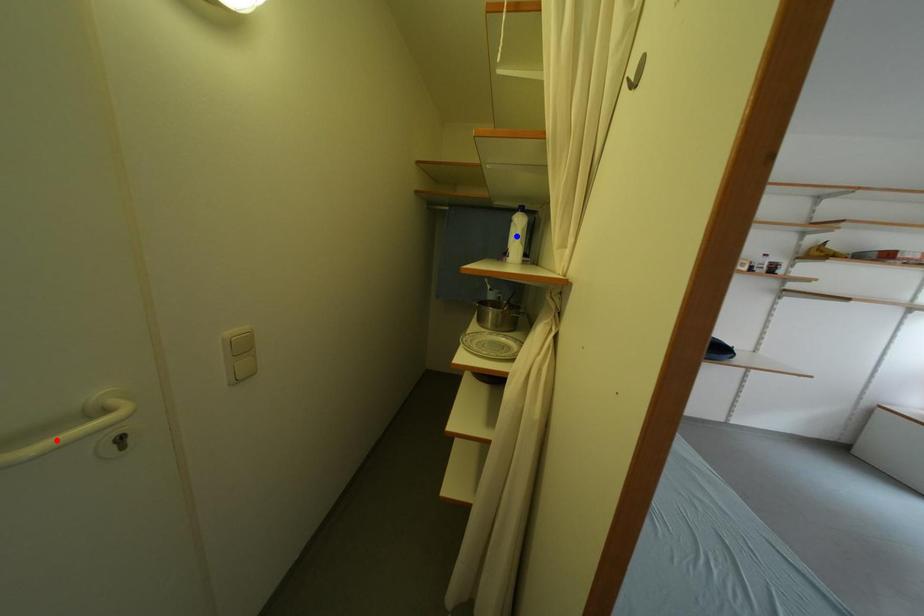
Question: In the image, two points are highlighted. Which point is nearer to the camera? Reply with the corresponding letter.

Choices:
 (A) blue point
 (B) red point

Answer: (B)